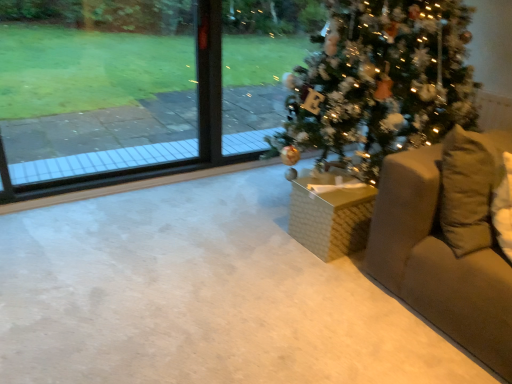
Identify the location of blank space to the left of white woven basket at center, the first furniture from the left. The image size is (512, 384). (269, 236).